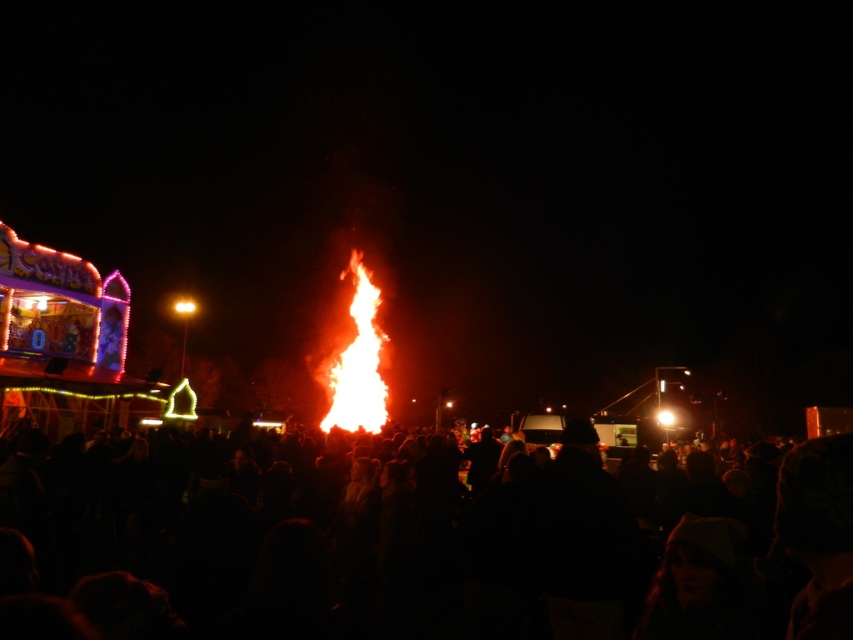
You are a photographer trying to capture the entire flame at center and the black matte crowd at center in one shot. Based on their sizes, can you fit both in your camera frame?

The black matte crowd at center might be wider than flame at center, so it is possible to fit both in the camera frame as long as the camera can accommodate the width of the crowd.

You are a photographer trying to capture the flame at center in the nighttime scene. The black matte crowd at center is blocking your view. Can you estimate whether the crowd is bigger or smaller than the flame?

The black matte crowd at center is larger in size than flame at center, so the crowd is bigger than the flame.